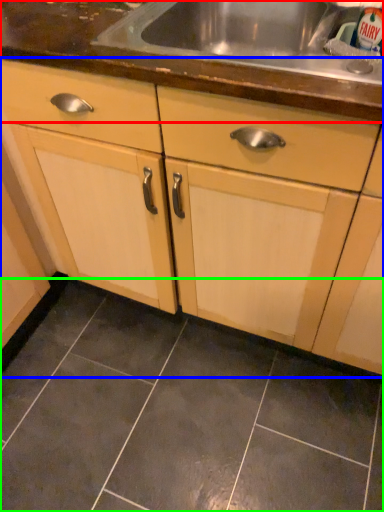
Question: Based on their relative distances, which object is nearer to countertop (highlighted by a red box)? Choose from cabinetry (highlighted by a blue box) and ceramic tile (highlighted by a green box).

Choices:
 (A) cabinetry
 (B) ceramic tile

Answer: (A)